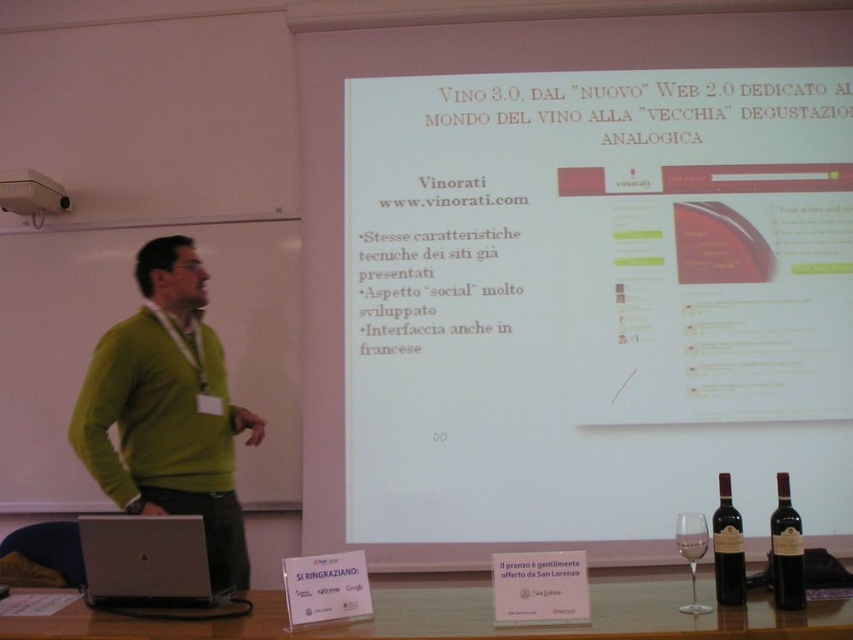
Is dark red glass bottle at lower right smaller than white plastic projector at upper left?

Indeed, dark red glass bottle at lower right has a smaller size compared to white plastic projector at upper left.

Can you confirm if dark red glass bottle at lower right is wider than white plastic projector at upper left?

In fact, dark red glass bottle at lower right might be narrower than white plastic projector at upper left.

Is point (714, 529) more distant than point (65, 198)?

No, (714, 529) is closer to viewer.

Where is `dark red glass bottle at lower right`? dark red glass bottle at lower right is located at coordinates (727, 547).

Does silver metallic laptop at lower left have a smaller size compared to dark glass bottle at lower right?

Incorrect, silver metallic laptop at lower left is not smaller in size than dark glass bottle at lower right.

Who is taller, silver metallic laptop at lower left or dark glass bottle at lower right?

With more height is dark glass bottle at lower right.

This screenshot has height=640, width=853. Find the location of `silver metallic laptop at lower left`. silver metallic laptop at lower left is located at coordinates coord(148,561).

Can you confirm if green sweater at left is shorter than dark red glass bottle at lower right?

In fact, green sweater at left may be taller than dark red glass bottle at lower right.

Who is more distant from viewer, (225, 531) or (712, 536)?

Positioned behind is point (225, 531).

Between point (88, 403) and point (740, 538), which one is positioned behind?

The point (88, 403) is more distant.

Where is `green sweater at left`? green sweater at left is located at coordinates (167, 410).